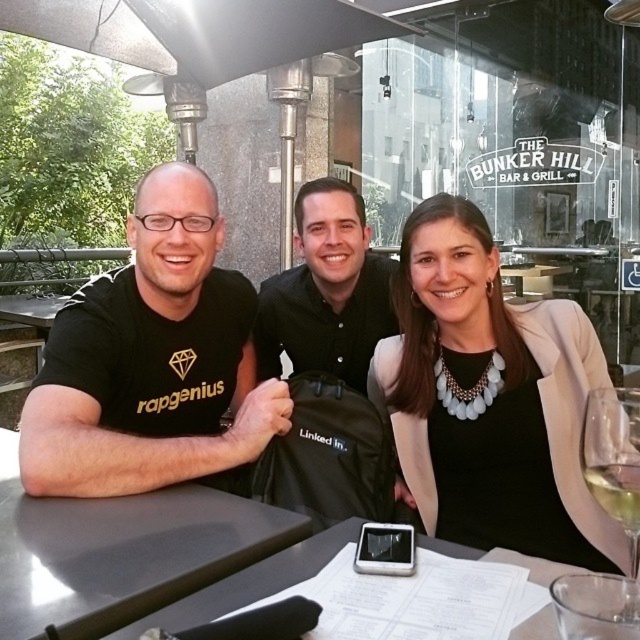
You are a waiter at The Bunker Hill Bar and Grill. You need to serve a customer who ordered a wine. Which glass should you choose between the clear glass wine glass at lower right and the white glass at lower right?

The clear glass wine glass at lower right is wider than the white glass at lower right, so you should choose the clear glass wine glass at lower right to serve the wine.

You are standing in front of the table where the three people are sitting. There are two points marked on the table surface. The first point is at coordinate point (627, 397) and the second point is at coordinate point (632, 474). If you want to place a small vase between these two points so that it is closer to the one that is nearer to you, where should you place it?

You should place the small vase closer to point (632, 474) because point (627, 397) is further away from you than point (632, 474). This ensures the vase is nearer to the point that is closer to your position.